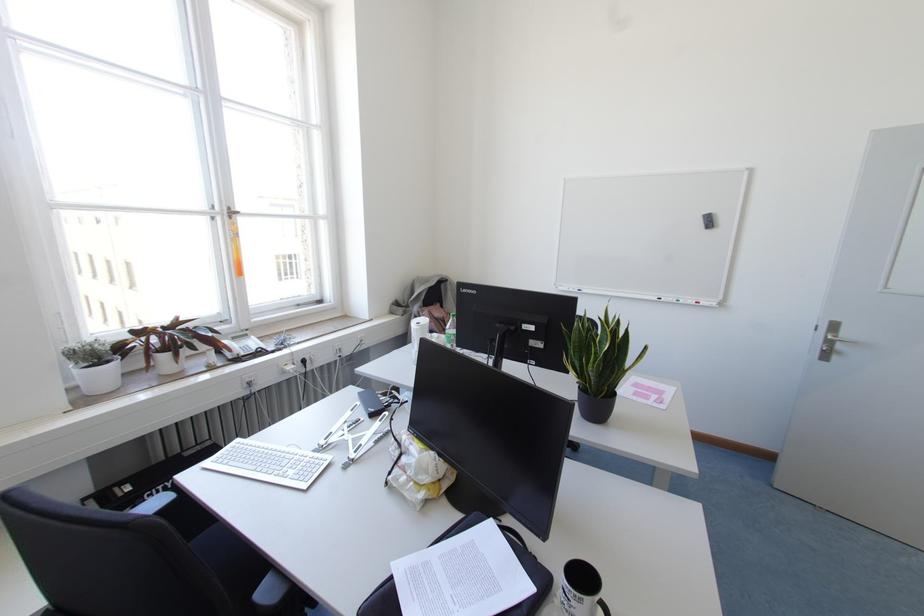
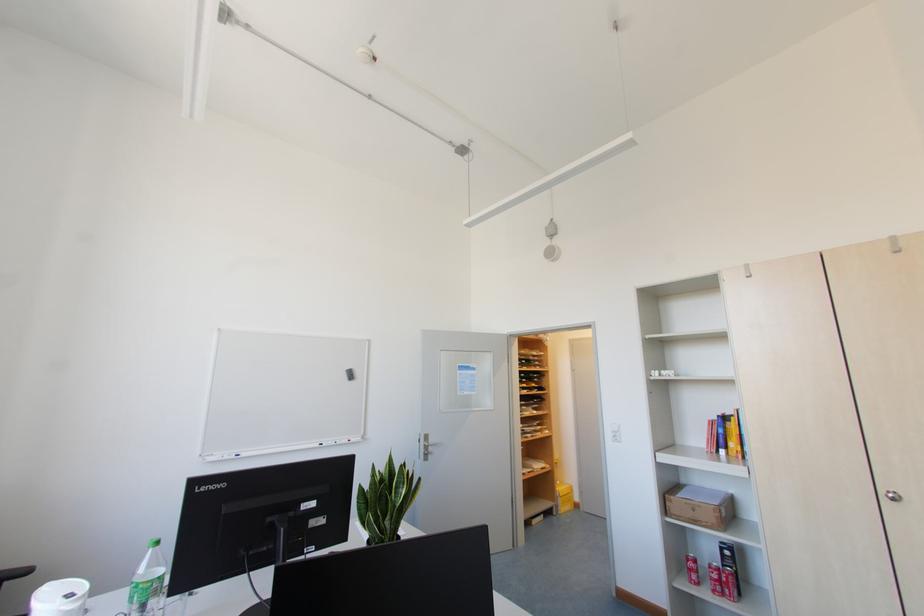
Question: The camera is either moving clockwise (left) or counter-clockwise (right) around the object. The first image is from the beginning of the video and the second image is from the end. Is the camera moving left or right when shooting the video?

Choices:
 (A) Left
 (B) Right

Answer: (A)